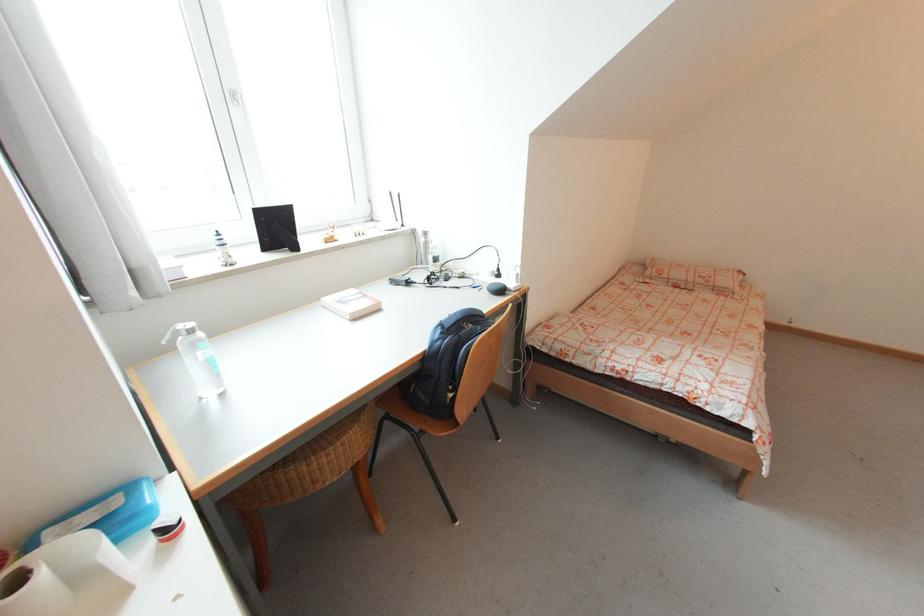
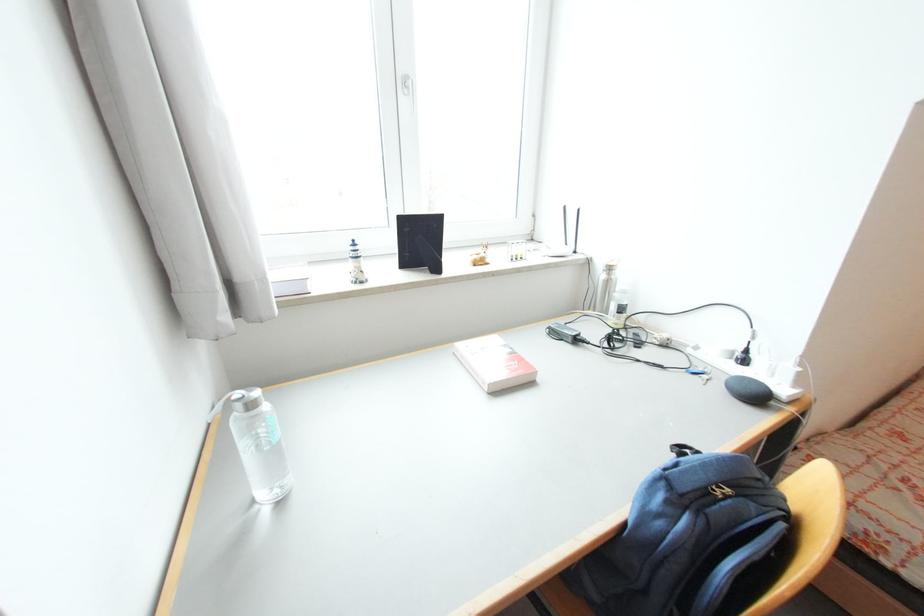
The images are taken continuously from a first-person perspective. In which direction are you moving?

The cameraman moved toward left, forward.